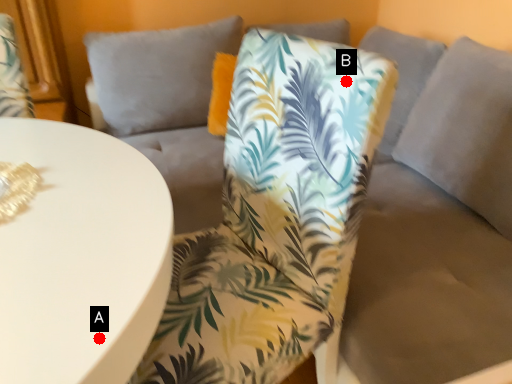
Question: Two points are circled on the image, labeled by A and B beside each circle. Which point is farther to the camera?

Choices:
 (A) A is further
 (B) B is further

Answer: (B)